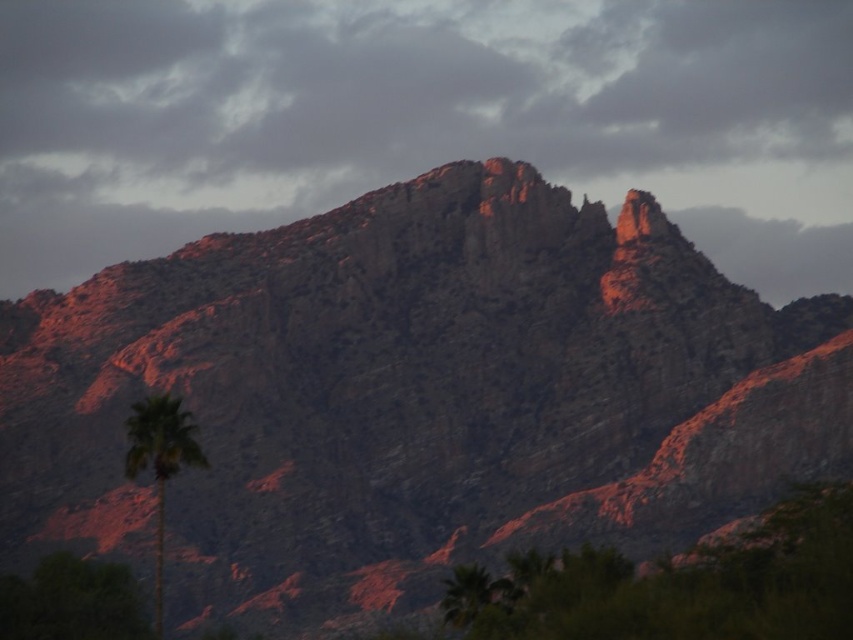
Question: Can you confirm if smokey gray cloud at upper center is positioned to the left of green leafy palm at lower left?

Choices:
 (A) yes
 (B) no

Answer: (B)

Question: Which of the following is the closest to the observer?

Choices:
 (A) smokey gray cloud at upper center
 (B) green leafy palm at lower left

Answer: (B)

Question: Can you confirm if smokey gray cloud at upper center is positioned below green leafy palm at lower left?

Choices:
 (A) yes
 (B) no

Answer: (B)

Question: Can you confirm if smokey gray cloud at upper center is bigger than green leafy palm at lower left?

Choices:
 (A) yes
 (B) no

Answer: (A)

Question: Which point is farther to the camera?

Choices:
 (A) green leafy palm at lower left
 (B) smokey gray cloud at upper center

Answer: (B)